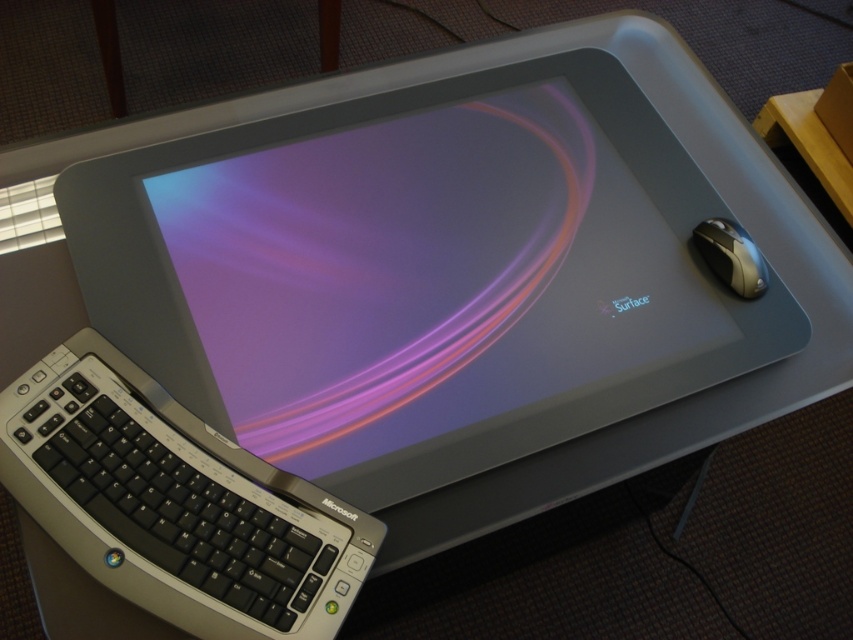
You are looking at the Microsoft Surface device and two points marked on the screen. The first point is at coordinate (152, 497) and the second at (715, 234). Which point is closer to your eyes?

Point (152, 497) is closer to the viewer than point (715, 234).

You are setting up a workspace and have a desk that can only accommodate items up to 40 cm in width. You need to place both the black plastic keyboard at lower left and the silver metallic mouse at right on the desk. Can both items fit side by side without exceeding the desk width?

The black plastic keyboard at lower left is wider than the silver metallic mouse at right. If the keyboard alone exceeds 40 cm, then both cannot fit. However, if the keyboard is under 40 cm, there might be space for the mouse alongside, but the total combined width must not exceed 40 cm.